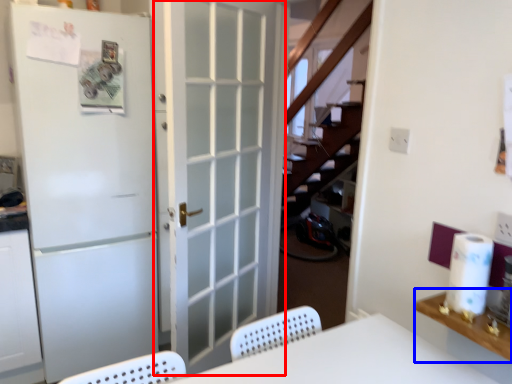
Question: Which point is further to the camera, door (highlighted by a red box) or counter top (highlighted by a blue box)?

Choices:
 (A) door
 (B) counter top

Answer: (A)